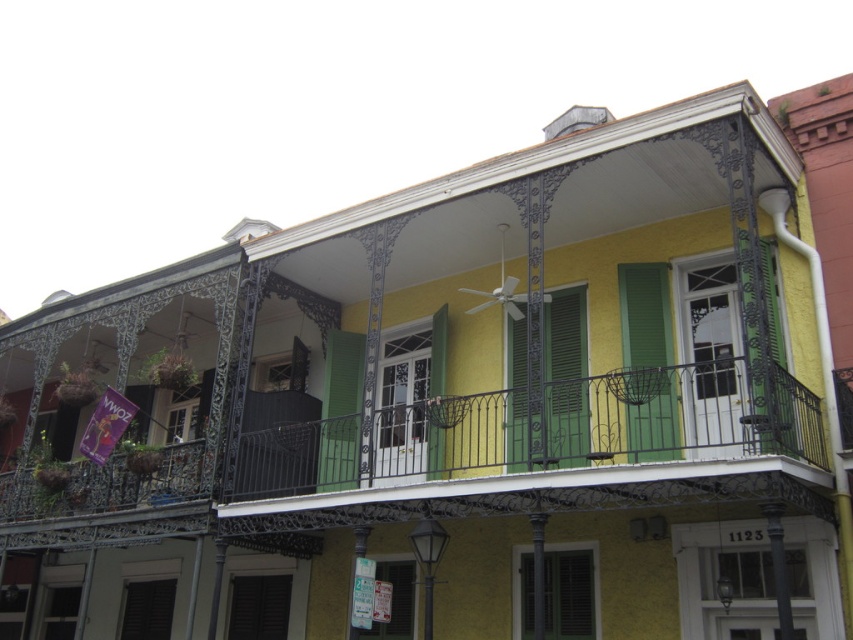
Can you confirm if green wrought iron balcony at center is shorter than green matte shutter at center?

Correct, green wrought iron balcony at center is not as tall as green matte shutter at center.

Consider the image. Measure the distance between green wrought iron balcony at center and green matte shutter at center.

They are 3.41 meters apart.

Image resolution: width=853 pixels, height=640 pixels. Identify the location of green wrought iron balcony at center. (541, 433).

Find the location of a particular element. The width and height of the screenshot is (853, 640). green wrought iron balcony at center is located at coordinates (541, 433).